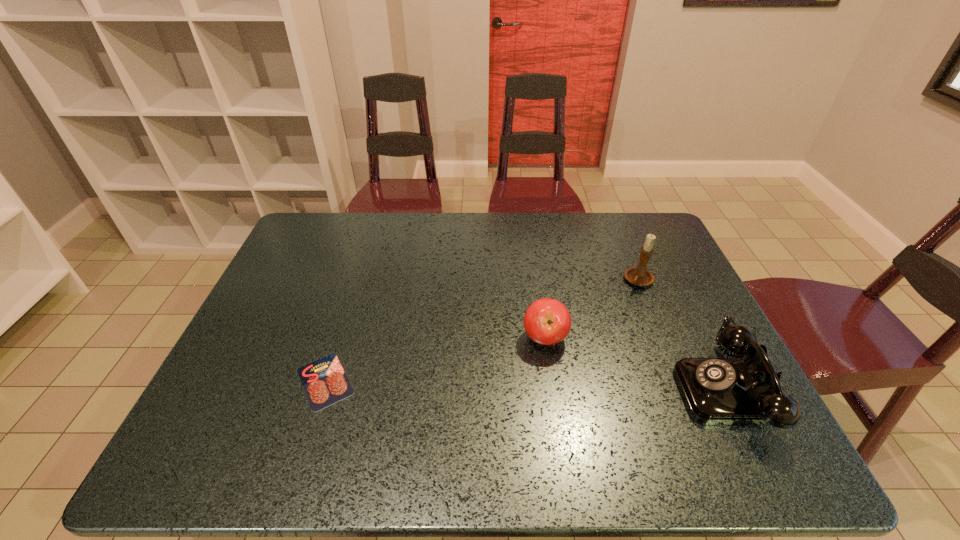
Where is `the shortest object`? This screenshot has height=540, width=960. the shortest object is located at coordinates (324, 381).

I want to click on the leftmost object, so pos(324,381).

I want to click on telephone, so click(745, 390).

You are a GUI agent. You are given a task and a screenshot of the screen. Output one action in this format:
    pyautogui.click(x=<x>, y=<y>)
    Task: Click on the tallest object
    The width and height of the screenshot is (960, 540).
    Given the screenshot: What is the action you would take?
    pyautogui.click(x=638, y=275)

The width and height of the screenshot is (960, 540). I want to click on candle holder, so tap(638, 275).

The width and height of the screenshot is (960, 540). I want to click on apple, so click(547, 321).

Image resolution: width=960 pixels, height=540 pixels. Find the location of `free space located 0.100m on the left of the salami`. free space located 0.100m on the left of the salami is located at coordinates (251, 381).

At what (x,y) coordinates should I click in order to perform the action: click on vacant point located 0.240m on the dial of the telephone. Please return your answer as a coordinate pair (x, y). The width and height of the screenshot is (960, 540). Looking at the image, I should click on (574, 389).

The width and height of the screenshot is (960, 540). Find the location of `vacant space located on the dial of the telephone`. vacant space located on the dial of the telephone is located at coordinates (636, 389).

The image size is (960, 540). I want to click on free space located on the dial of the telephone, so click(x=565, y=389).